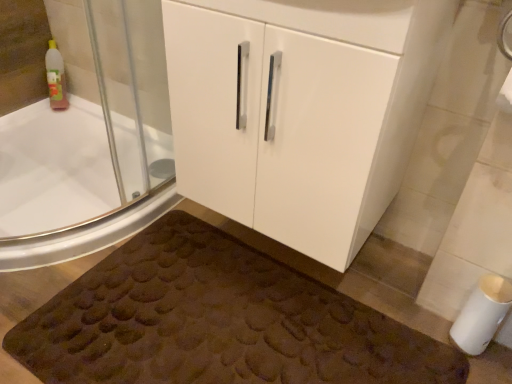
Where is `vacant area that is in front of white matte toilet paper at lower right`? The height and width of the screenshot is (384, 512). vacant area that is in front of white matte toilet paper at lower right is located at coordinates pos(474,370).